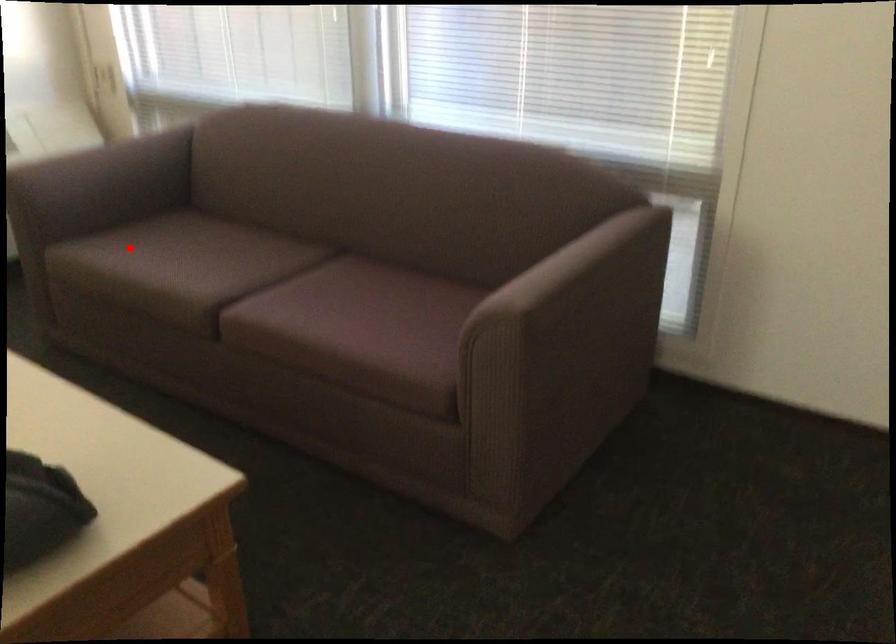
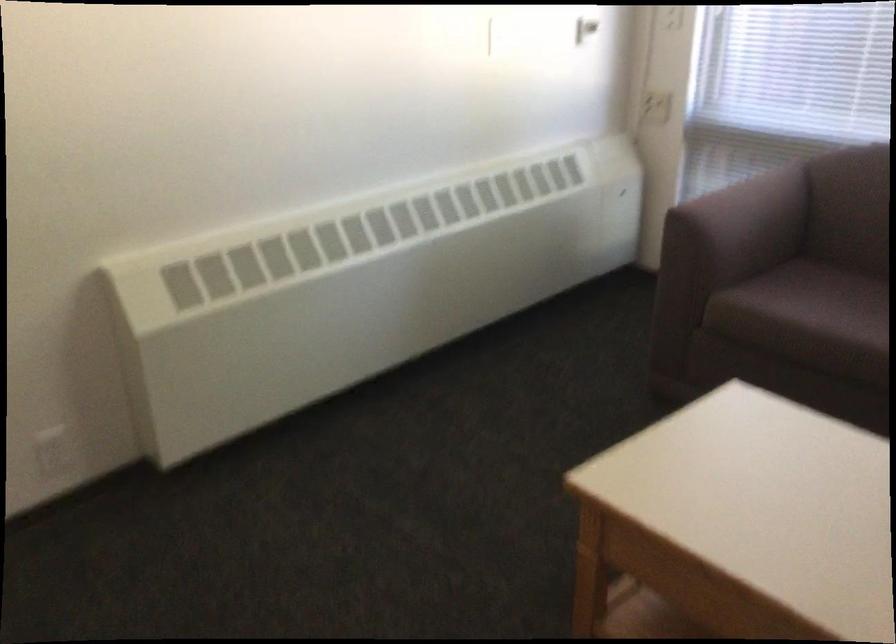
Question: I am providing you with two images of the same scene from different viewpoints. In image1, a red point is highlighted. Considering the same 3D point in image2, which of the following is correct?

Choices:
 (A) It is closer
 (B) It is farther

Answer: (A)